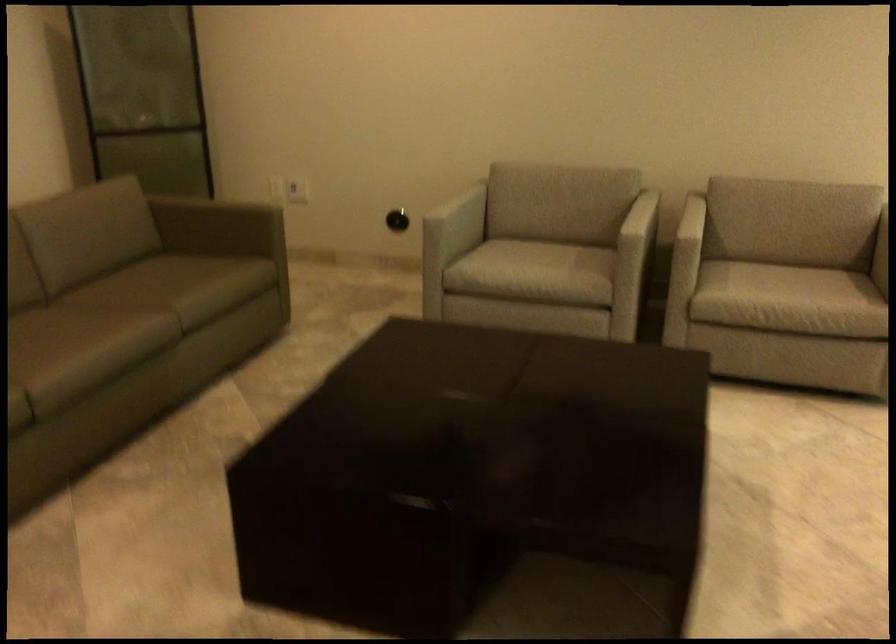
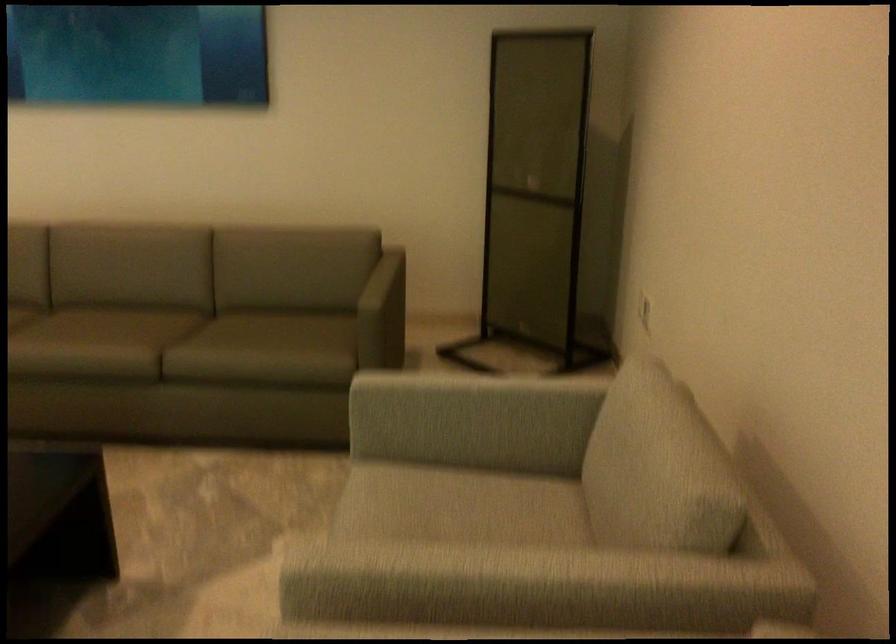
Locate, in the second image, the point that corresponds to (479,247) in the first image.

(455, 491)